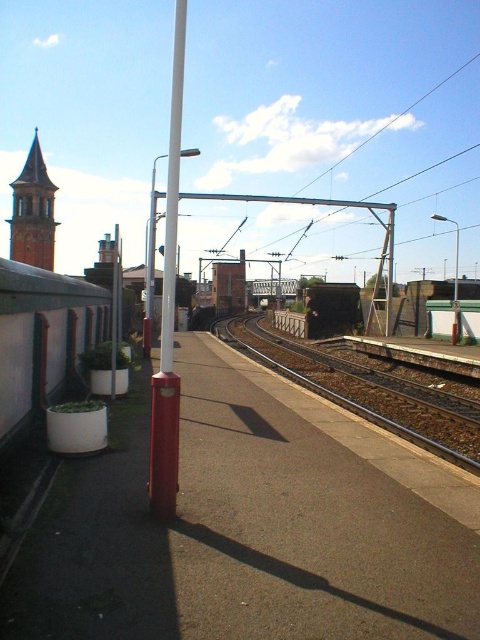
Can you confirm if white concrete platform at lower left is positioned above white glossy pole at center?

Actually, white concrete platform at lower left is below white glossy pole at center.

Is point (340, 572) positioned behind point (176, 412)?

No.

The image size is (480, 640). I want to click on white concrete platform at lower left, so click(x=250, y=529).

Is white concrete platform at lower left to the left of brown gravel train track at center from the viewer's perspective?

No, white concrete platform at lower left is not to the left of brown gravel train track at center.

Who is positioned more to the left, white concrete platform at lower left or brown gravel train track at center?

From the viewer's perspective, brown gravel train track at center appears more on the left side.

Which is in front, point (223, 438) or point (324, 369)?

Positioned in front is point (223, 438).

At what (x,y) coordinates should I click in order to perform the action: click on white concrete platform at lower left. Please return your answer as a coordinate pair (x, y). Looking at the image, I should click on (250, 529).

Is brown gravel train track at center shorter than white glossy pole at center?

Yes.

Who is more forward, (319, 380) or (168, 344)?

Point (168, 344) is in front.

I want to click on brown gravel train track at center, so click(361, 397).